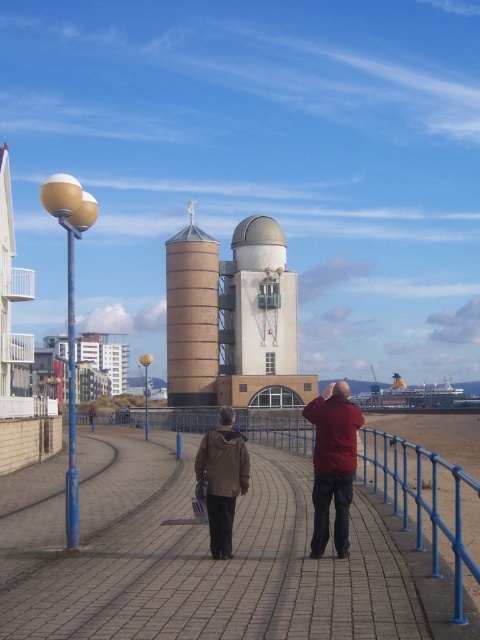
Question: Is brown leather jacket at center positioned at the back of matte red jacket at center?

Choices:
 (A) no
 (B) yes

Answer: (B)

Question: Is brown leather jacket at center positioned in front of matte red jacket at center?

Choices:
 (A) no
 (B) yes

Answer: (A)

Question: Which object is positioned farthest from the brick paved walkway at center?

Choices:
 (A) brown matte jacket at center
 (B) brown leather jacket at center
 (C) brown brick tower at center

Answer: (C)

Question: Among these points, which one is farthest from the camera?

Choices:
 (A) coord(228,424)
 (B) coord(216,269)
 (C) coord(275,529)

Answer: (B)

Question: Considering the relative positions of brick paved walkway at center and brown brick tower at center in the image provided, where is brick paved walkway at center located with respect to brown brick tower at center?

Choices:
 (A) above
 (B) below

Answer: (B)

Question: Among these points, which one is farthest from the camera?

Choices:
 (A) (345, 593)
 (B) (350, 440)
 (C) (338, 442)
 (D) (216, 428)

Answer: (D)